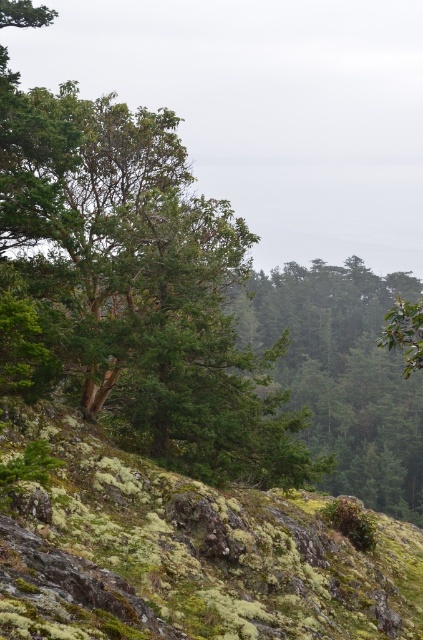
Does green mossy rock at center appear on the left side of green matte tree at center?

Yes, green mossy rock at center is to the left of green matte tree at center.

Does green mossy rock at center have a greater height compared to green matte tree at center?

In fact, green mossy rock at center may be shorter than green matte tree at center.

Which is in front, point (397, 557) or point (401, 275)?

Point (397, 557) is in front.

Find the location of a particular element. green mossy rock at center is located at coordinates (184, 554).